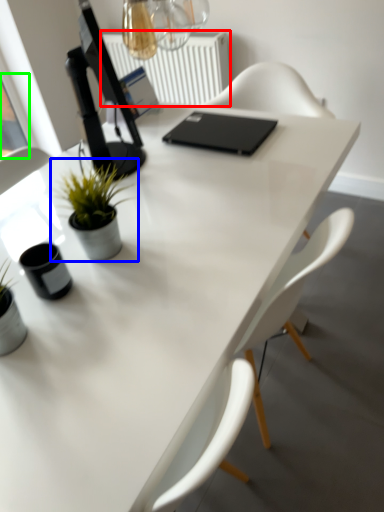
Question: Which is farther away from radiator (highlighted by a red box)? houseplant (highlighted by a blue box) or window screen (highlighted by a green box)?

Choices:
 (A) houseplant
 (B) window screen

Answer: (A)